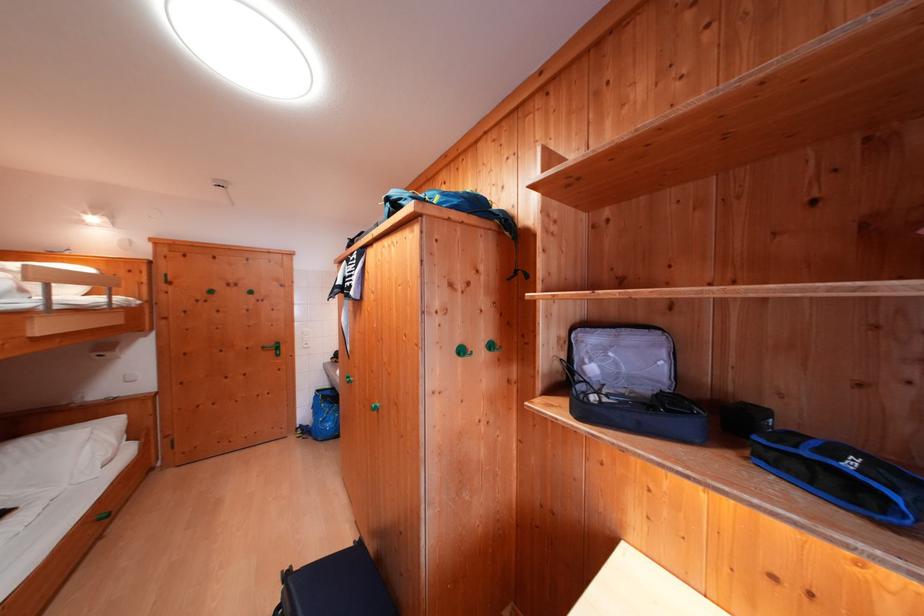
This screenshot has height=616, width=924. What are the coordinates of `blue backpack` in the screenshot? It's located at (842, 475).